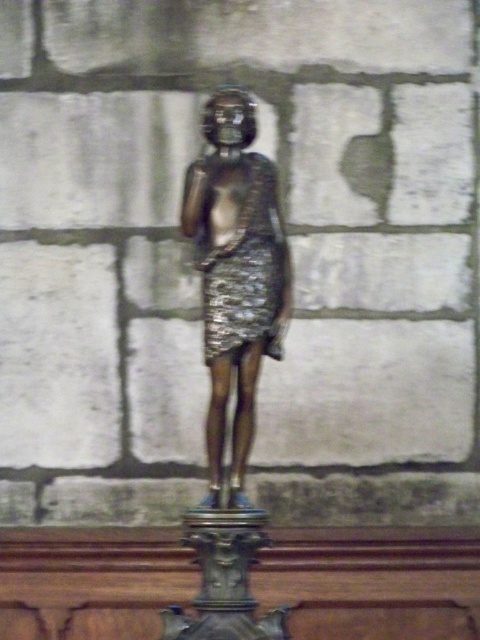
You are an interior designer planning to place a new lamp in the room where the shiny bronze statue at center and the shiny metallic dress at center are displayed. The lamp needs to be placed between them. Considering their sizes, which object should the lamp be closer to?

The shiny bronze statue at center is much taller than the shiny metallic dress at center, so the lamp should be placed closer to the shiny metallic dress at center to balance the visual weight.

You are an art curator planning to display both the shiny bronze statue at center and the shiny metallic dress at center in a gallery. Based on their sizes, which object should be placed on the pedestal to ensure proper visibility and stability?

The shiny bronze statue at center should be placed on the pedestal because it is larger in size compared to the shiny metallic dress at center, ensuring better stability and visibility.